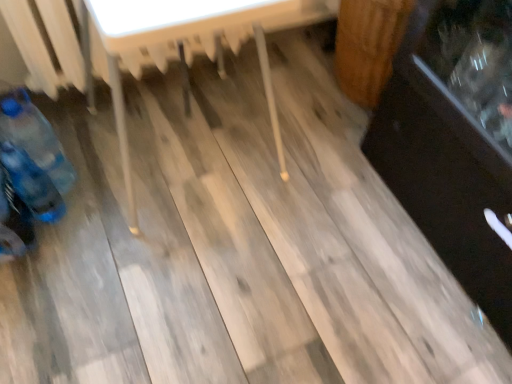
Image resolution: width=512 pixels, height=384 pixels. I want to click on vacant space that is in between wooden table at center and blue plastic bottle at lower left, the first bottle in the bottom-to-top sequence, so click(92, 198).